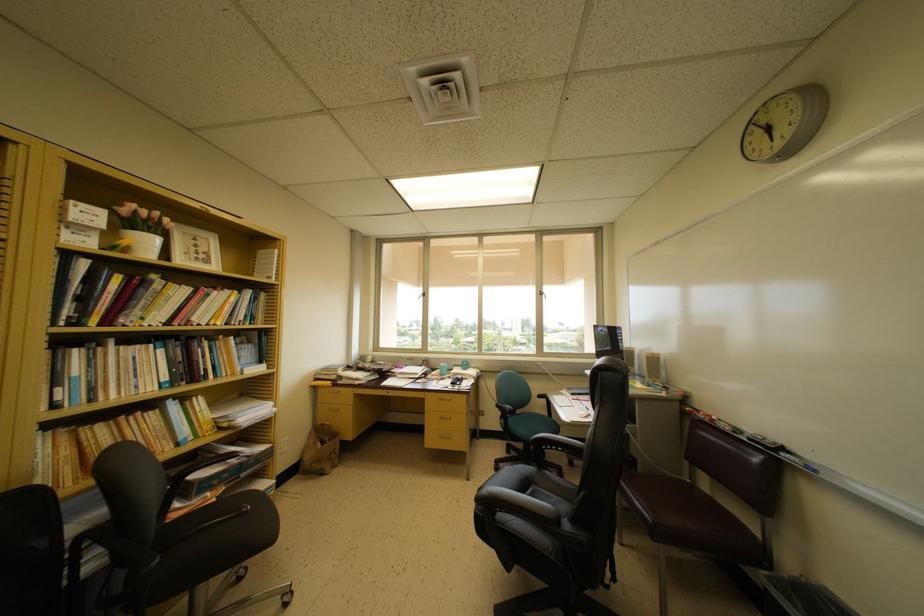
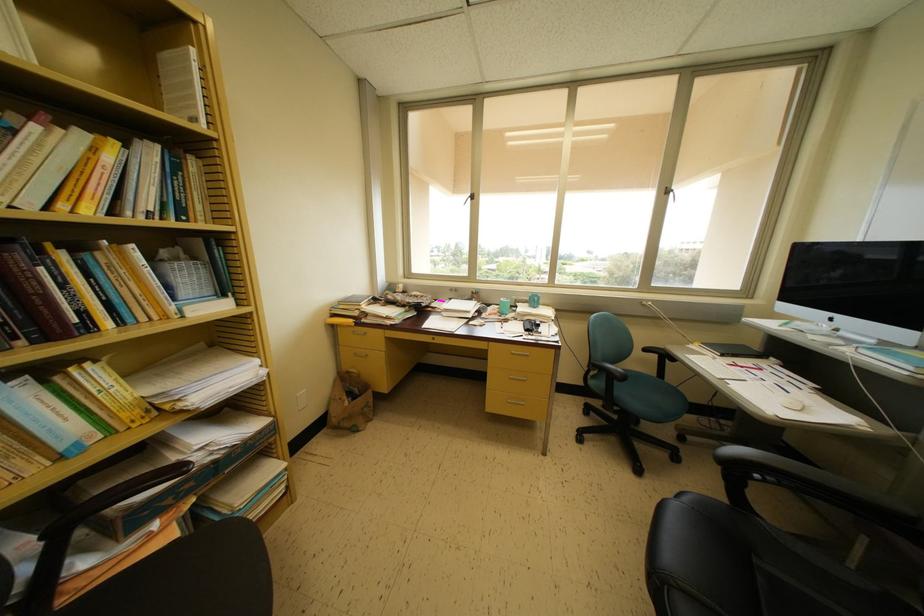
In the second image, find the point that corresponds to point 462,387 in the first image.

(537, 331)